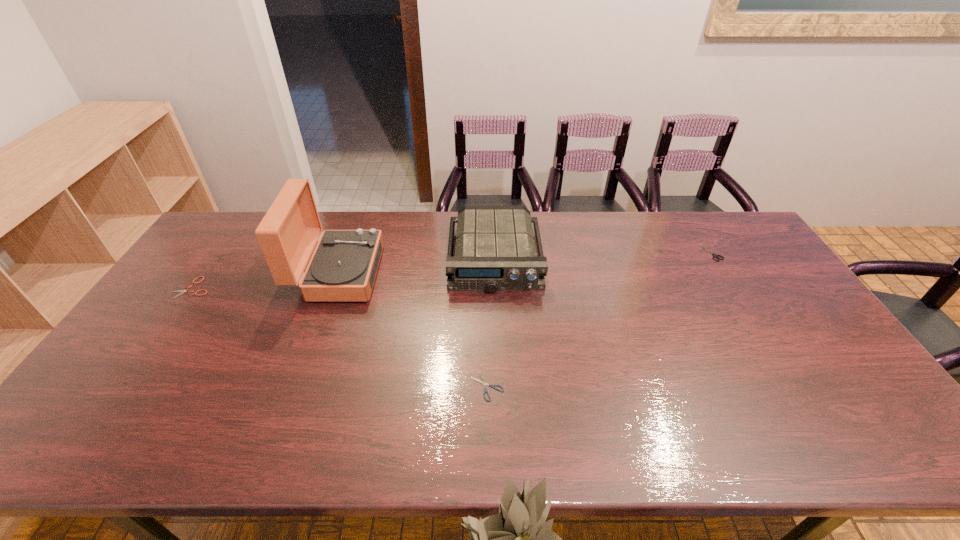
Locate an element on the screen. The image size is (960, 540). phonograph record is located at coordinates (343, 267).

Where is `the fourth object from right to left`? The height and width of the screenshot is (540, 960). the fourth object from right to left is located at coordinates (343, 267).

The width and height of the screenshot is (960, 540). I want to click on radio receiver, so click(495, 250).

Image resolution: width=960 pixels, height=540 pixels. In order to click on the tallest shears in this screenshot , I will do `click(715, 255)`.

This screenshot has height=540, width=960. Find the location of `the rightmost shears`. the rightmost shears is located at coordinates [715, 255].

This screenshot has width=960, height=540. I want to click on the leftmost shears, so click(182, 291).

At what (x,y) coordinates should I click in order to perform the action: click on the leftmost object. Please return your answer as a coordinate pair (x, y). Image resolution: width=960 pixels, height=540 pixels. Looking at the image, I should click on (182, 291).

Identify the location of the nearest object. (482, 381).

Where is `the shortest object`? The width and height of the screenshot is (960, 540). the shortest object is located at coordinates (482, 381).

This screenshot has height=540, width=960. Identify the location of free space located 0.200m on the face of the tallest object. (441, 273).